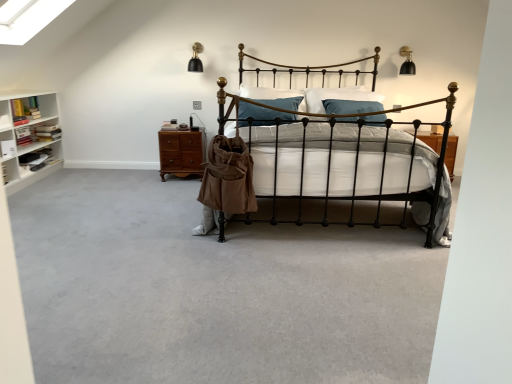
What do you see at coordinates (347, 160) in the screenshot? This screenshot has height=384, width=512. I see `black wrought iron bed at center` at bounding box center [347, 160].

What do you see at coordinates (228, 177) in the screenshot? The width and height of the screenshot is (512, 384). I see `tan canvas bag at center` at bounding box center [228, 177].

Measure the distance between brown wood drawer at center and camera.

A distance of 4.13 meters exists between brown wood drawer at center and camera.

The height and width of the screenshot is (384, 512). What do you see at coordinates (29, 139) in the screenshot?
I see `white wooden bookshelf at left` at bounding box center [29, 139].

I want to click on gray carpet at center, so click(213, 290).

In terms of width, does black wrought iron bed at center look wider or thinner when compared to white wooden bookshelf at left?

In the image, black wrought iron bed at center appears to be wider than white wooden bookshelf at left.

From the image's perspective, which one is positioned higher, black wrought iron bed at center or white wooden bookshelf at left?

white wooden bookshelf at left appears higher in the image.

Considering the sizes of black wrought iron bed at center and white wooden bookshelf at left in the image, is black wrought iron bed at center bigger or smaller than white wooden bookshelf at left?

Considering their sizes, black wrought iron bed at center takes up more space than white wooden bookshelf at left.

Is black wrought iron bed at center at the right side of gray carpet at center?

Yes.

Is black wrought iron bed at center turned away from gray carpet at center?

No, black wrought iron bed at center is not facing the opposite direction of gray carpet at center.

Considering the relative sizes of black wrought iron bed at center and gray carpet at center in the image provided, is black wrought iron bed at center shorter than gray carpet at center?

No.

From the image's perspective, relative to black wrought iron bed at center, is gray carpet at center above or below?

Based on their image positions, gray carpet at center is located beneath black wrought iron bed at center.

Which is further, [133,266] or [426,190]?

Point [426,190]

Is gray carpet at center oriented towards black wrought iron bed at center?

No, gray carpet at center is not turned towards black wrought iron bed at center.

Considering the sizes of gray carpet at center and black wrought iron bed at center in the image, is gray carpet at center wider or thinner than black wrought iron bed at center?

gray carpet at center is wider than black wrought iron bed at center.

Locate an element on the screen. The image size is (512, 384). bed in front of the teal velvet pillow at center is located at coordinates (347, 160).

Visually, is black wrought iron bed at center positioned to the left or to the right of teal velvet pillow at center?

black wrought iron bed at center is positioned on teal velvet pillow at center's right side.

From a real-world perspective, who is located lower, black wrought iron bed at center or teal velvet pillow at center?

black wrought iron bed at center is physically lower.

Is black wrought iron bed at center thinner than teal velvet pillow at center?

No, black wrought iron bed at center is not thinner than teal velvet pillow at center.

Considering the sizes of objects teal velvet pillow at center and gray carpet at center in the image provided, who is bigger, teal velvet pillow at center or gray carpet at center?

gray carpet at center.

Considering the positions of objects teal velvet pillow at center and gray carpet at center in the image provided, who is behind, teal velvet pillow at center or gray carpet at center?

teal velvet pillow at center is further away from the camera.

Considering the relative sizes of teal velvet pillow at center and gray carpet at center in the image provided, is teal velvet pillow at center taller than gray carpet at center?

Yes, teal velvet pillow at center is taller than gray carpet at center.

I want to click on shelf below the teal velvet pillow at center (from a real-world perspective), so 29,139.

Would you consider teal velvet pillow at center to be distant from white wooden bookshelf at left?

That's right, there is a large distance between teal velvet pillow at center and white wooden bookshelf at left.

Is teal velvet pillow at center located outside white wooden bookshelf at left?

teal velvet pillow at center lies outside white wooden bookshelf at left's area.

Considering the sizes of teal velvet pillow at center and white wooden bookshelf at left in the image, is teal velvet pillow at center bigger or smaller than white wooden bookshelf at left?

In the image, teal velvet pillow at center appears to be smaller than white wooden bookshelf at left.

Which of these two, brown wood drawer at center or black wrought iron bed at center, is thinner?

brown wood drawer at center.

Find the location of a particular element. Image resolution: width=512 pixels, height=384 pixels. bed that appears on the right of brown wood drawer at center is located at coordinates (347, 160).

Would you say brown wood drawer at center contains black wrought iron bed at center?

Actually, black wrought iron bed at center is outside brown wood drawer at center.

Where is `bed below the white wooden bookshelf at left (from the image's perspective)`? Image resolution: width=512 pixels, height=384 pixels. bed below the white wooden bookshelf at left (from the image's perspective) is located at coordinates (347, 160).

The height and width of the screenshot is (384, 512). Find the location of `bed above the gray carpet at center (from the image's perspective)`. bed above the gray carpet at center (from the image's perspective) is located at coordinates (347, 160).

When comparing their distances from black wrought iron bed at center, does brown wood drawer at center or tan canvas bag at center seem closer?

The object closer to black wrought iron bed at center is tan canvas bag at center.

Based on their spatial positions, is black wrought iron bed at center or white wooden bookshelf at left closer to gray carpet at center?

black wrought iron bed at center.

Based on their spatial positions, is tan canvas bag at center or black wrought iron bed at center further from brown wood drawer at center?

black wrought iron bed at center lies further to brown wood drawer at center than the other object.

Based on their spatial positions, is brown wood drawer at center or gray carpet at center further from white wooden bookshelf at left?

Among the two, gray carpet at center is located further to white wooden bookshelf at left.

From the image, which object appears to be nearer to brown wood drawer at center, gray carpet at center or black wrought iron bed at center?

gray carpet at center is positioned closer to the anchor brown wood drawer at center.

Looking at this image, estimate the real-world distances between objects in this image. Which object is closer to brown wood drawer at center, black wrought iron bed at center or teal velvet pillow at center?

teal velvet pillow at center lies closer to brown wood drawer at center than the other object.

When comparing their distances from tan canvas bag at center, does black wrought iron bed at center or gray carpet at center seem further?

The object further to tan canvas bag at center is gray carpet at center.

When comparing their distances from gray carpet at center, does black wrought iron bed at center or tan canvas bag at center seem further?

black wrought iron bed at center is positioned further to the anchor gray carpet at center.

This screenshot has height=384, width=512. I want to click on pillow between tan canvas bag at center and brown wood drawer at center from front to back, so click(x=274, y=97).

In order to click on trench coat located between gray carpet at center and brown wood drawer at center in the depth direction in this screenshot , I will do `click(228, 177)`.

Locate an element on the screen. This screenshot has width=512, height=384. shelf located between gray carpet at center and brown wood drawer at center in the depth direction is located at coordinates (29, 139).

The width and height of the screenshot is (512, 384). In order to click on concrete between white wooden bookshelf at left and teal velvet pillow at center in the horizontal direction in this screenshot , I will do `click(213, 290)`.